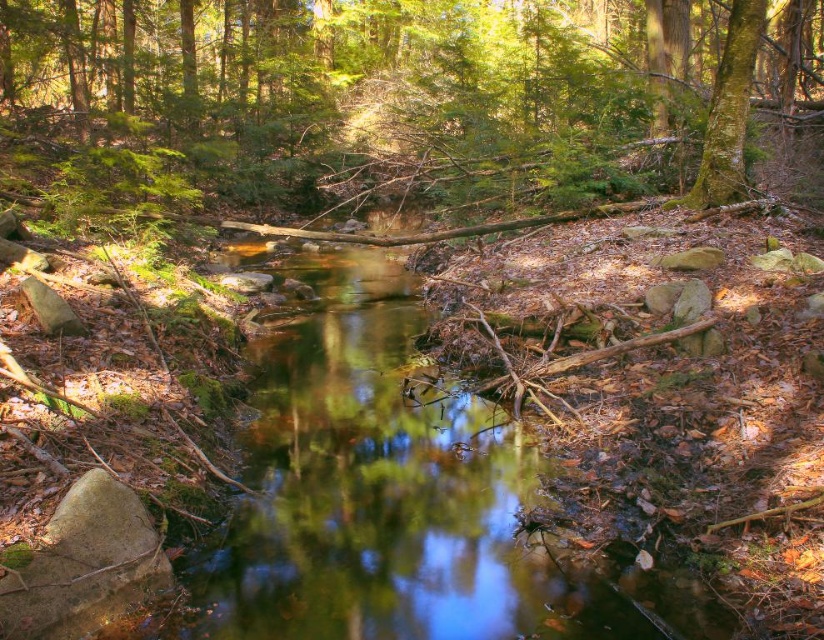
Question: Is green reflective water at center wider than green mossy tree at upper right?

Choices:
 (A) yes
 (B) no

Answer: (B)

Question: Which of the following is the closest to the observer?

Choices:
 (A) green reflective water at center
 (B) green mossy tree at upper right
 (C) green matte tree at center

Answer: (A)

Question: Does green reflective water at center have a greater width compared to green mossy tree at upper right?

Choices:
 (A) yes
 (B) no

Answer: (B)

Question: Does green matte tree at center have a larger size compared to green reflective water at center?

Choices:
 (A) no
 (B) yes

Answer: (B)

Question: Which is farther from the green reflective water at center?

Choices:
 (A) green mossy tree at upper right
 (B) green matte tree at center

Answer: (B)

Question: Which of the following is the closest to the observer?

Choices:
 (A) green reflective water at center
 (B) green matte tree at center

Answer: (A)